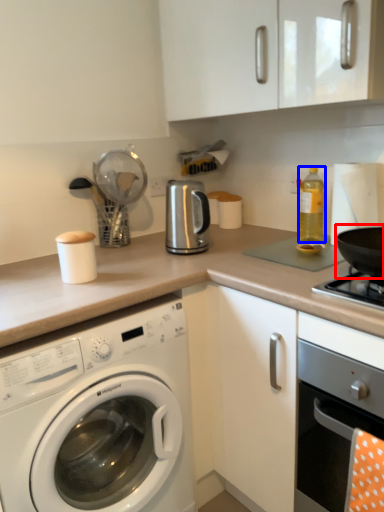
Question: Which object is further to the camera taking this photo, wok (highlighted by a red box) or bottle (highlighted by a blue box)?

Choices:
 (A) wok
 (B) bottle

Answer: (B)